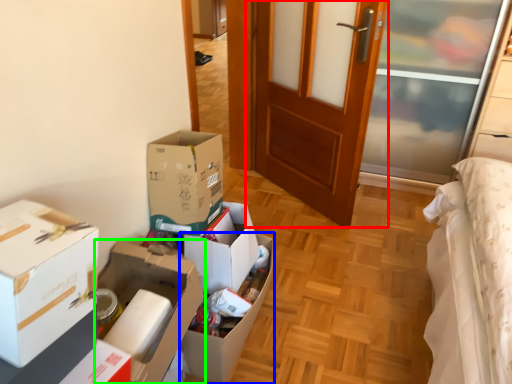
Question: Based on their relative distances, which object is farther from door (highlighted by a red box)? Choose from box (highlighted by a blue box) and box (highlighted by a green box).

Choices:
 (A) box
 (B) box

Answer: (B)